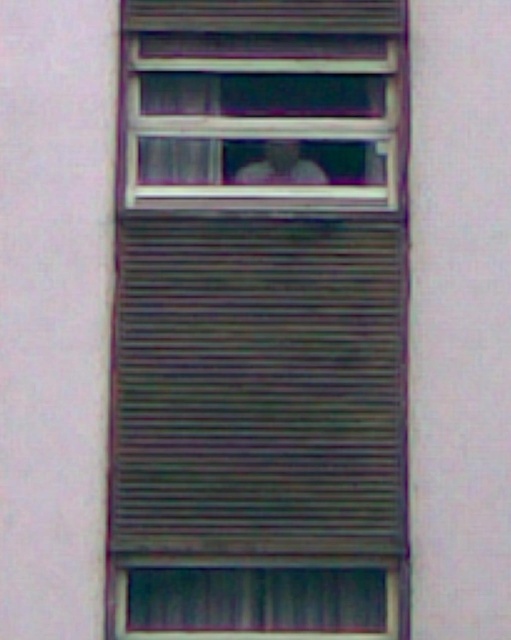
Question: Which object appears farthest from the camera in this image?

Choices:
 (A) light skin tone human face at center
 (B) metallic gray shutter at center

Answer: (A)

Question: Can you confirm if metallic gray shutter at center is positioned to the right of light skin tone human face at center?

Choices:
 (A) yes
 (B) no

Answer: (B)

Question: Observing the image, what is the correct spatial positioning of metallic gray shutter at center in reference to light skin tone human face at center?

Choices:
 (A) left
 (B) right

Answer: (A)

Question: Which object is closer to the camera taking this photo?

Choices:
 (A) metallic gray shutter at center
 (B) light skin tone human face at center

Answer: (A)

Question: Is metallic gray shutter at center thinner than light skin tone human face at center?

Choices:
 (A) no
 (B) yes

Answer: (A)